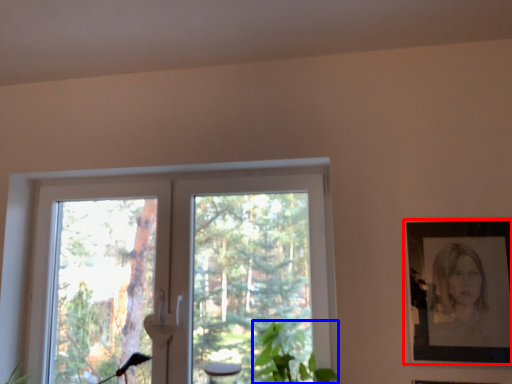
Question: Among these objects, which one is nearest to the camera, picture frame (highlighted by a red box) or plant (highlighted by a blue box)?

Choices:
 (A) picture frame
 (B) plant

Answer: (B)